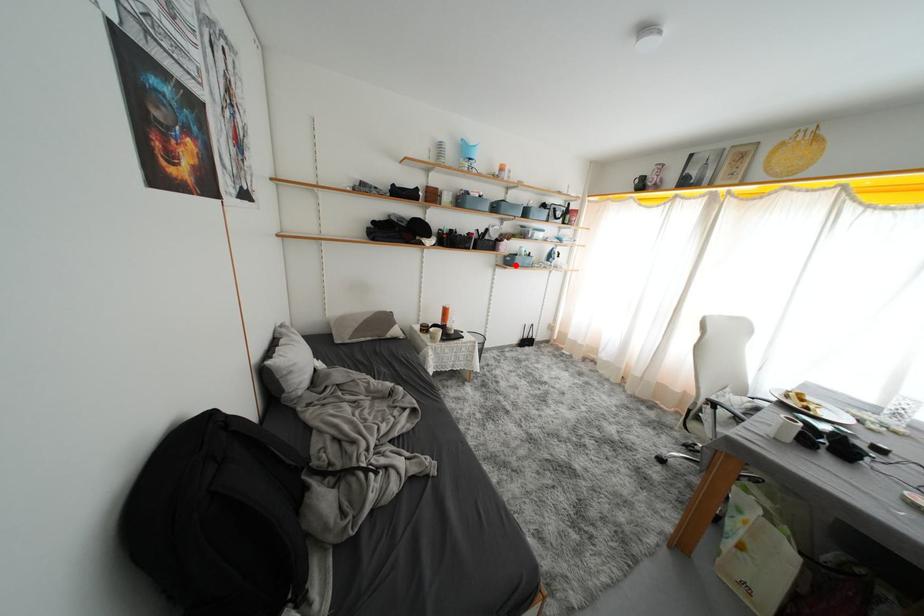
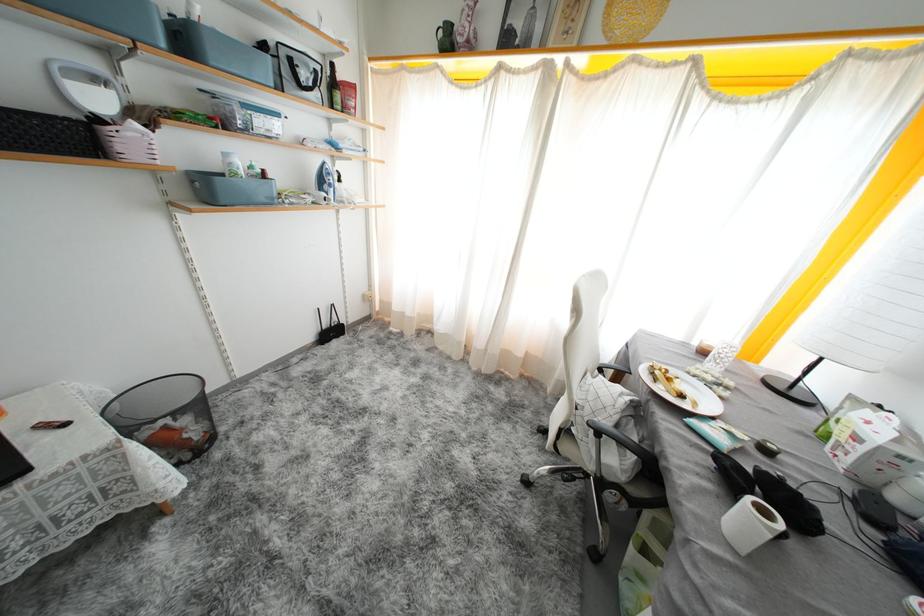
The point at the highlighted location is marked in the first image. Where is the corresponding point in the second image?

(215, 196)